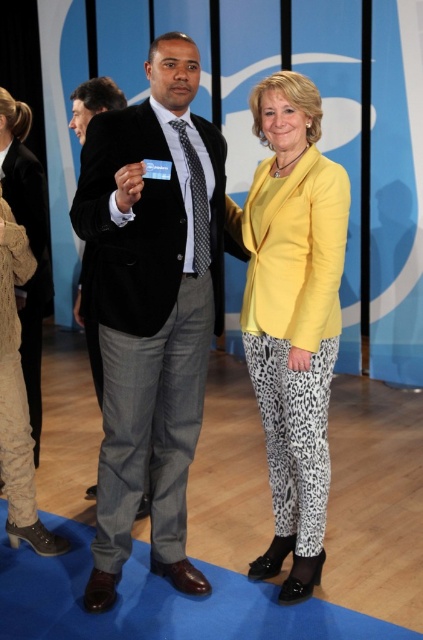
Question: Is yellow matte blazer at center thinner than knitted beige sweater at left?

Choices:
 (A) yes
 (B) no

Answer: (B)

Question: Which is farther from the velvet black coat at center?

Choices:
 (A) knitted beige sweater at left
 (B) yellow matte blazer at center
 (C) matte black suit at center

Answer: (A)

Question: Estimate the real-world distances between objects in this image. Which object is closer to the matte black suit at center?

Choices:
 (A) yellow matte blazer at center
 (B) knitted beige sweater at left

Answer: (B)

Question: Is the position of velvet black coat at center less distant than that of yellow matte blazer at center?

Choices:
 (A) no
 (B) yes

Answer: (B)

Question: Is velvet black coat at center closer to camera compared to matte black suit at center?

Choices:
 (A) yes
 (B) no

Answer: (A)

Question: Which of these objects is positioned closest to the velvet black coat at center?

Choices:
 (A) yellow matte blazer at center
 (B) knitted beige sweater at left
 (C) matte black suit at center

Answer: (A)